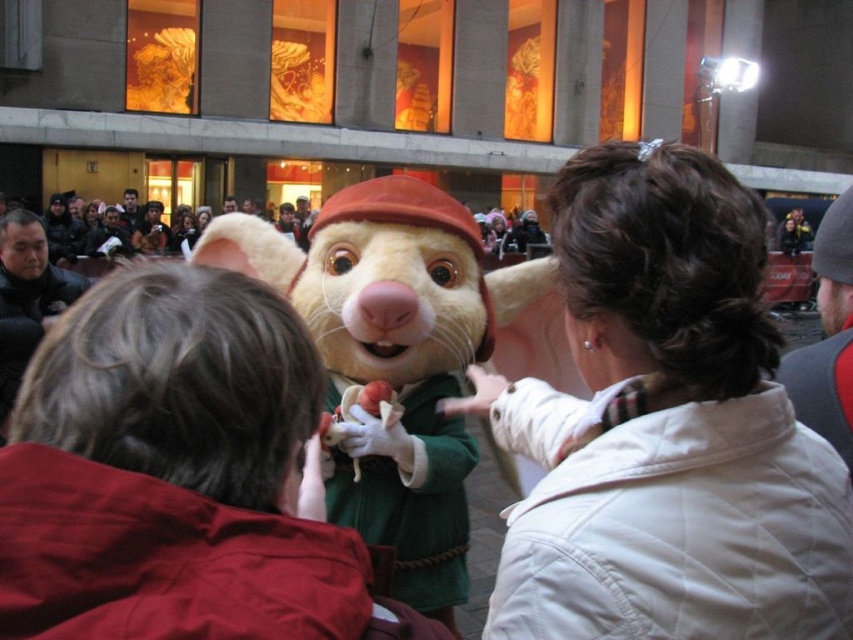
Is white quilted jacket at center closer to camera compared to fluffy beige costume at center?

Yes, white quilted jacket at center is in front of fluffy beige costume at center.

Between white quilted jacket at center and fluffy beige costume at center, which one has less height?

fluffy beige costume at center is shorter.

You are a GUI agent. You are given a task and a screenshot of the screen. Output one action in this format:
    pyautogui.click(x=<x>, y=<y>)
    Task: Click on the white quilted jacket at center
    The image size is (853, 640).
    Given the screenshot: What is the action you would take?
    pyautogui.click(x=665, y=428)